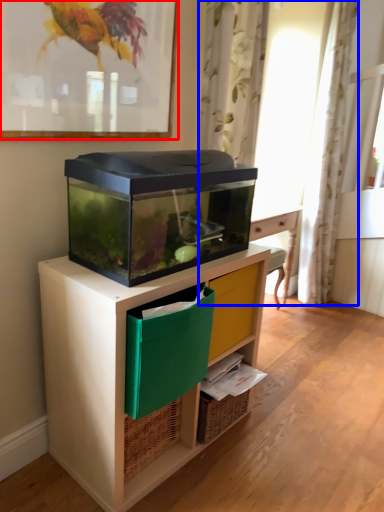
Question: Which object is closer to the camera taking this photo, picture frame (highlighted by a red box) or curtain (highlighted by a blue box)?

Choices:
 (A) picture frame
 (B) curtain

Answer: (A)